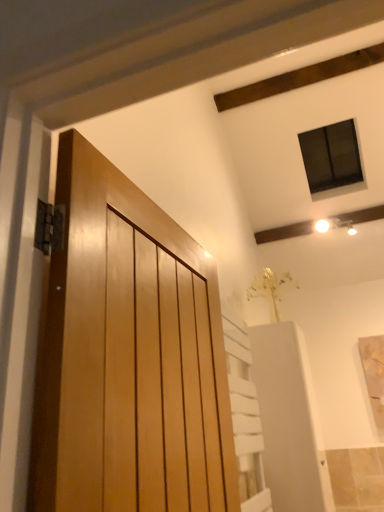
Question: Is glossy wood door at left aimed at white matte elevator at lower right?

Choices:
 (A) yes
 (B) no

Answer: (B)

Question: Is glossy wood door at left smaller than white matte elevator at lower right?

Choices:
 (A) no
 (B) yes

Answer: (B)

Question: Is glossy wood door at left to the left of white matte elevator at lower right from the viewer's perspective?

Choices:
 (A) yes
 (B) no

Answer: (A)

Question: From a real-world perspective, is glossy wood door at left beneath white matte elevator at lower right?

Choices:
 (A) no
 (B) yes

Answer: (A)

Question: Is glossy wood door at left bigger than white matte elevator at lower right?

Choices:
 (A) no
 (B) yes

Answer: (A)

Question: Is glossy wood door at left not close to white matte elevator at lower right?

Choices:
 (A) no
 (B) yes

Answer: (B)

Question: Would you say white matte elevator at lower right is outside glossy wood door at left?

Choices:
 (A) yes
 (B) no

Answer: (A)

Question: Can you confirm if white matte elevator at lower right is shorter than glossy wood door at left?

Choices:
 (A) yes
 (B) no

Answer: (B)

Question: Does white matte elevator at lower right have a larger size compared to glossy wood door at left?

Choices:
 (A) yes
 (B) no

Answer: (A)

Question: Is white matte elevator at lower right thinner than glossy wood door at left?

Choices:
 (A) yes
 (B) no

Answer: (B)

Question: From the image's perspective, is white matte elevator at lower right over glossy wood door at left?

Choices:
 (A) yes
 (B) no

Answer: (B)

Question: Could glossy wood door at left be considered to be inside white matte elevator at lower right?

Choices:
 (A) yes
 (B) no

Answer: (B)

Question: From a real-world perspective, is glossy wood door at left physically located above or below white matte elevator at lower right?

Choices:
 (A) below
 (B) above

Answer: (B)